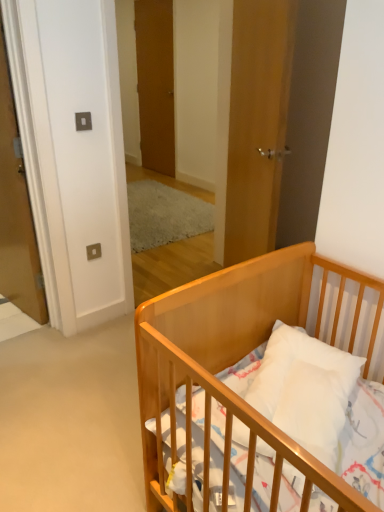
What do you see at coordinates (16, 211) in the screenshot?
I see `matte wood door at left, the second door from the front` at bounding box center [16, 211].

Image resolution: width=384 pixels, height=512 pixels. Identify the location of wooden door at center, which is the 3th door from front to back. (155, 83).

Identify the location of matte wood door at left, the 3th door in the right-to-left sequence. (16, 211).

Which is in front, matte wood door at left, the second door from the back, or wooden door at center, which is the 3th door from front to back?

matte wood door at left, the second door from the back, is closer to the camera.

How many degrees apart are the facing directions of matte wood door at left, the 3th door in the right-to-left sequence, and wooden door at center, which is the 3th door from front to back?

7.61 degrees separate the facing orientations of matte wood door at left, the 3th door in the right-to-left sequence, and wooden door at center, which is the 3th door from front to back.

Is matte wood door at left, the 3th door in the right-to-left sequence, bigger than wooden door at center, which is the 2th door from right to left?

Yes.

The height and width of the screenshot is (512, 384). Identify the location of the 3rd door above the light wood crib at lower right (from the image's perspective). (155, 83).

Does light wood crib at lower right appear on the left side of wooden door at center, which is the 3th door from front to back?

In fact, light wood crib at lower right is to the right of wooden door at center, which is the 3th door from front to back.

From a real-world perspective, which is physically below, light wood crib at lower right or wooden door at center, the 1th door when ordered from back to front?

light wood crib at lower right.

Can you tell me how much light wood crib at lower right and wooden door at center, which is the 3th door from front to back, differ in facing direction?

The angle between the facing direction of light wood crib at lower right and the facing direction of wooden door at center, which is the 3th door from front to back, is 0.00177 degrees.

In the image, is wooden door at center, the 1th door when ordered from back to front, positioned in front of or behind light wood crib at lower right?

wooden door at center, the 1th door when ordered from back to front, is behind light wood crib at lower right.

What's the angular difference between wooden door at center, which is the 2th door from right to left, and light wood crib at lower right's facing directions?

wooden door at center, which is the 2th door from right to left, and light wood crib at lower right are facing 0.00177 degrees away from each other.

Which point is more forward, (155, 37) or (155, 352)?

The point (155, 352) is more forward.

Considering the relative sizes of wooden door at center, which is the 3th door from front to back, and matte wood door at left, the second door from the back, in the image provided, is wooden door at center, which is the 3th door from front to back, thinner than matte wood door at left, the second door from the back,?

Yes, wooden door at center, which is the 3th door from front to back, is thinner than matte wood door at left, the second door from the back.

Can you confirm if wooden door at center, the 1th door when ordered from back to front, is smaller than matte wood door at left, the 3th door in the right-to-left sequence?

Yes.

Is wooden door at center, the 1th door when ordered from back to front, turned away from matte wood door at left, the second door from the front?

No, wooden door at center, the 1th door when ordered from back to front, is not facing the opposite direction of matte wood door at left, the second door from the front.

From a real-world perspective, is wooden door at center, the second door from the left, beneath wooden door at center, the third door from the left?

No.

Considering the relative sizes of wooden door at center, the 1th door when ordered from back to front, and wooden door at center, which is counted as the 3th door, starting from the back, in the image provided, is wooden door at center, the 1th door when ordered from back to front, bigger than wooden door at center, which is counted as the 3th door, starting from the back,?

No.

Identify the location of door that is the 2nd one when counting forward from the wooden door at center, the 1th door when ordered from back to front. The width and height of the screenshot is (384, 512). (257, 123).

In terms of width, does wooden door at center, the 1th door when ordered from back to front, look wider or thinner when compared to wooden door at center, which is counted as the 3th door, starting from the back?

wooden door at center, the 1th door when ordered from back to front, is thinner than wooden door at center, which is counted as the 3th door, starting from the back.

Is wooden door at center, which is the 3th door from front to back, a part of wooden door at center, positioned as the first door in front-to-back order?

No, wooden door at center, which is the 3th door from front to back, is located outside of wooden door at center, positioned as the first door in front-to-back order.

In the image, is wooden door at center, acting as the first door starting from the right, positioned in front of or behind wooden door at center, the second door from the left?

wooden door at center, acting as the first door starting from the right, is positioned closer to the viewer than wooden door at center, the second door from the left.

Does point (295, 3) lie behind point (163, 75)?

No, (295, 3) is in front of (163, 75).

How different are the orientations of wooden door at center, the third door from the left, and wooden door at center, the 1th door when ordered from back to front, in degrees?

There is a 27.7-degree angle between the facing directions of wooden door at center, the third door from the left, and wooden door at center, the 1th door when ordered from back to front.

Could you tell me if wooden door at center, the third door from the left, is turned towards light wood crib at lower right?

No, wooden door at center, the third door from the left, is not facing towards light wood crib at lower right.

From the image's perspective, is wooden door at center, the third door from the left, located beneath light wood crib at lower right?

No, from the image's perspective, wooden door at center, the third door from the left, is not beneath light wood crib at lower right.

From a real-world perspective, who is located lower, wooden door at center, acting as the first door starting from the right, or light wood crib at lower right?

light wood crib at lower right is physically lower.

Does point (241, 4) appear closer or farther from the camera than point (154, 492)?

Point (241, 4) is positioned farther from the camera compared to point (154, 492).

You are a GUI agent. You are given a task and a screenshot of the screen. Output one action in this format:
    pyautogui.click(x=<x>, y=<y>)
    Task: Click on the door on the left of wooden door at center, which is the 2th door from right to left
    
    Given the screenshot: What is the action you would take?
    pyautogui.click(x=16, y=211)

Where is `infant bed on the right of the wooden door at center, which is the 3th door from front to back`? infant bed on the right of the wooden door at center, which is the 3th door from front to back is located at coordinates tap(235, 358).

Looking at the image, which one is located closer to wooden door at center, which is the 3th door from front to back, light wood crib at lower right or wooden door at center, positioned as the first door in front-to-back order?

wooden door at center, positioned as the first door in front-to-back order, is positioned closer to the anchor wooden door at center, which is the 3th door from front to back.

Looking at the image, which one is located further to light wood crib at lower right, wooden door at center, the third door from the left, or wooden door at center, the second door from the left?

Among the two, wooden door at center, the second door from the left, is located further to light wood crib at lower right.

When comparing their distances from wooden door at center, the 1th door when ordered from back to front, does matte wood door at left, the second door from the front, or light wood crib at lower right seem closer?

matte wood door at left, the second door from the front, is positioned closer to the anchor wooden door at center, the 1th door when ordered from back to front.

Consider the image. When comparing their distances from wooden door at center, acting as the first door starting from the right, does light wood crib at lower right or matte wood door at left, the first door positioned from the left, seem further?

matte wood door at left, the first door positioned from the left, lies further to wooden door at center, acting as the first door starting from the right, than the other object.

Estimate the real-world distances between objects in this image. Which object is further from light wood crib at lower right, wooden door at center, the second door from the left, or matte wood door at left, the second door from the back?

wooden door at center, the second door from the left, lies further to light wood crib at lower right than the other object.

Which object lies nearer to the anchor point wooden door at center, which is the 2th door from right to left, light wood crib at lower right or matte wood door at left, the second door from the front?

matte wood door at left, the second door from the front, is closer to wooden door at center, which is the 2th door from right to left.

Considering their positions, is wooden door at center, the second door from the left, positioned closer to wooden door at center, acting as the first door starting from the right, than light wood crib at lower right?

Based on the image, light wood crib at lower right appears to be nearer to wooden door at center, acting as the first door starting from the right.

Looking at the image, which one is located closer to wooden door at center, positioned as the first door in front-to-back order, matte wood door at left, the 3th door in the right-to-left sequence, or light wood crib at lower right?

light wood crib at lower right.

You are a GUI agent. You are given a task and a screenshot of the screen. Output one action in this format:
    pyautogui.click(x=<x>, y=<y>)
    Task: Click on the door between wooden door at center, acting as the first door starting from the right, and wooden door at center, which is the 3th door from front to back, in the front-back direction
    
    Given the screenshot: What is the action you would take?
    pyautogui.click(x=16, y=211)